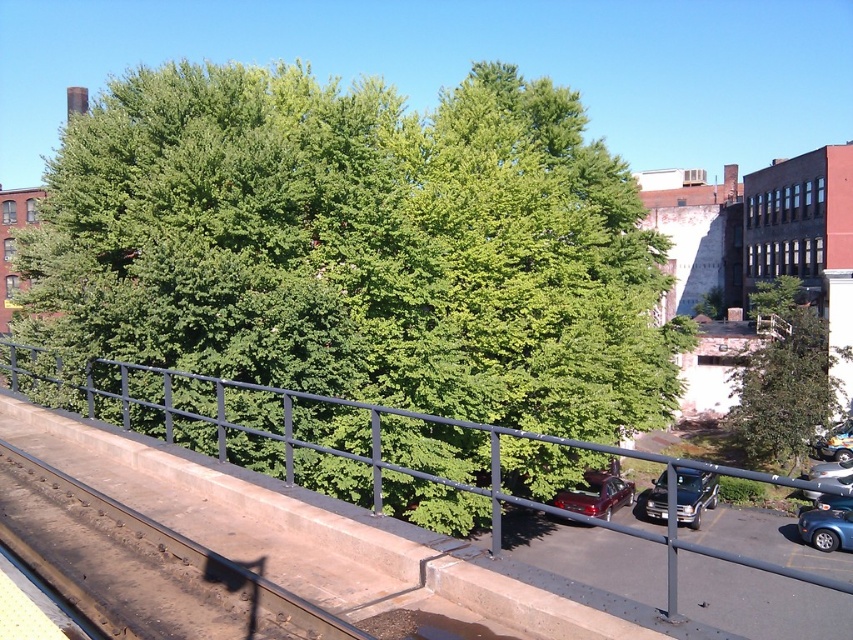
You are a photographer trying to capture a photo of the metallic blue car at lower right without the green leafy tree at upper center blocking the view. Based on their sizes, which object would require you to adjust your camera angle more to avoid obstruction?

The green leafy tree at upper center is larger in size than the metallic blue car at lower right, so you would need to adjust your camera angle more to avoid the tree obstructing the view of the car.